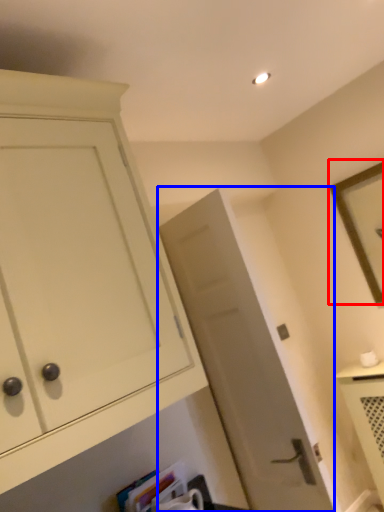
Question: Which object is further to the camera taking this photo, picture frame (highlighted by a red box) or door (highlighted by a blue box)?

Choices:
 (A) picture frame
 (B) door

Answer: (A)